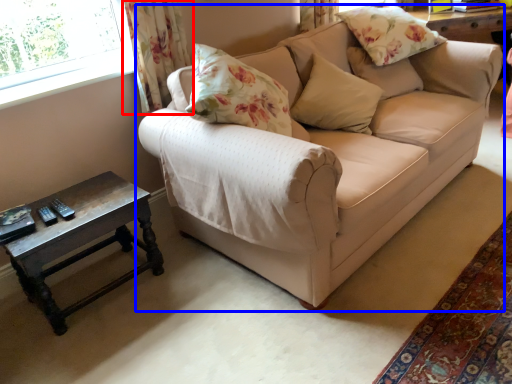
Question: Which object appears farthest to the camera in this image, curtain (highlighted by a red box) or studio couch (highlighted by a blue box)?

Choices:
 (A) curtain
 (B) studio couch

Answer: (A)